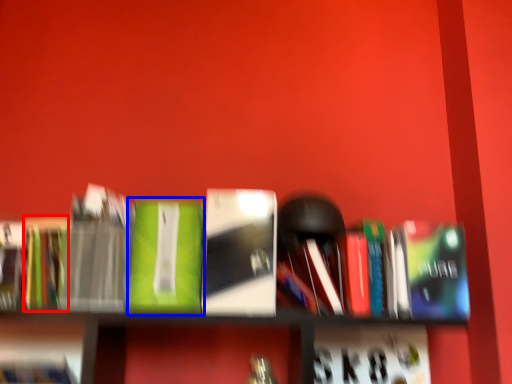
Question: Among these objects, which one is nearest to the camera, paperback book (highlighted by a red box) or book (highlighted by a blue box)?

Choices:
 (A) paperback book
 (B) book

Answer: (B)